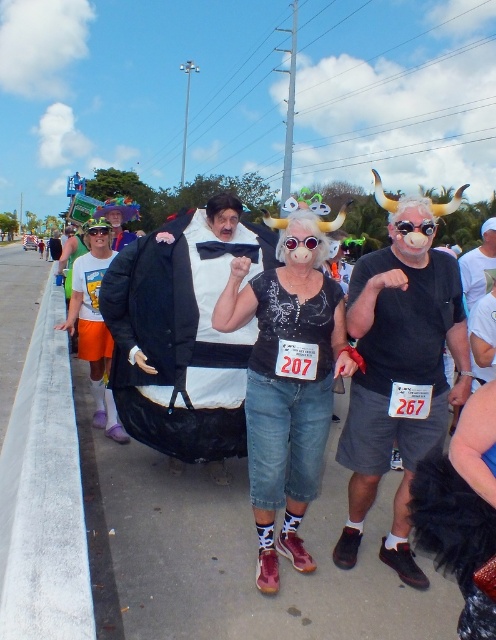
Does black matte t-shirt at center have a larger size compared to matte white t-shirt at center?

Correct, black matte t-shirt at center is larger in size than matte white t-shirt at center.

Can you confirm if black matte t-shirt at center is positioned to the left of matte white t-shirt at center?

In fact, black matte t-shirt at center is to the right of matte white t-shirt at center.

Describe the element at coordinates (399, 372) in the screenshot. I see `black matte t-shirt at center` at that location.

At what (x,y) coordinates should I click in order to perform the action: click on black matte t-shirt at center. Please return your answer as a coordinate pair (x, y). Looking at the image, I should click on (399, 372).

Which is above, black satin bed at center or black matte t-shirt at center?

black satin bed at center is higher up.

Can you confirm if black satin bed at center is shorter than black matte t-shirt at center?

Correct, black satin bed at center is not as tall as black matte t-shirt at center.

What are the coordinates of `black satin bed at center` in the screenshot? It's located at (401, 362).

Can you confirm if denim shorts at center is positioned below orange cotton shorts at left?

Yes.

Does point (328, 342) come closer to viewer compared to point (86, 291)?

Yes, point (328, 342) is closer to viewer.

I want to click on denim shorts at center, so click(288, 384).

Locate an element on the screen. The image size is (496, 640). denim shorts at center is located at coordinates (288, 384).